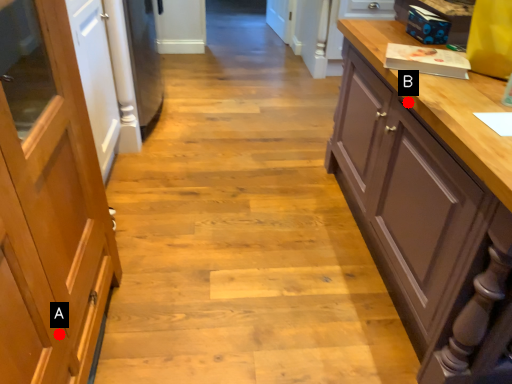
Question: Two points are circled on the image, labeled by A and B beside each circle. Which point appears farthest from the camera in this image?

Choices:
 (A) A is further
 (B) B is further

Answer: (B)